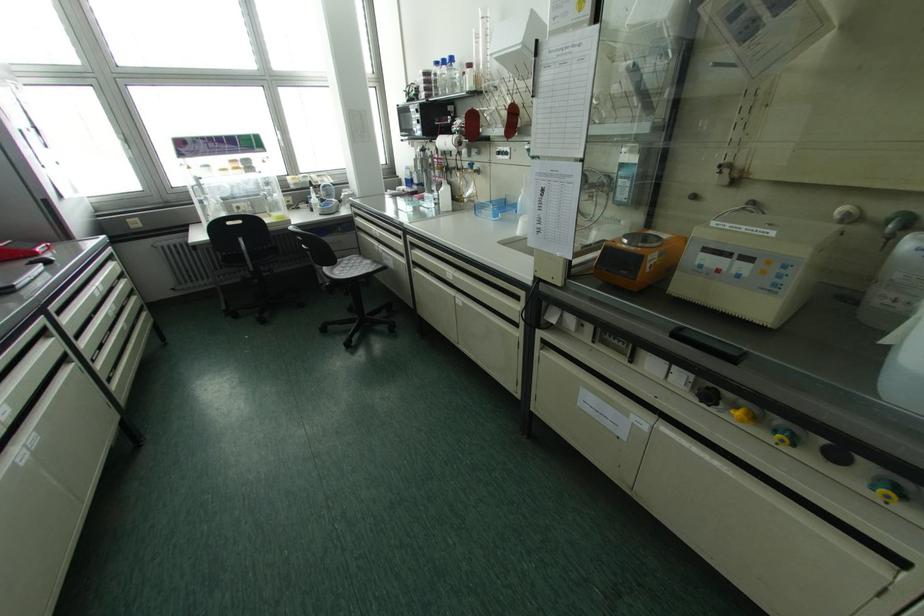
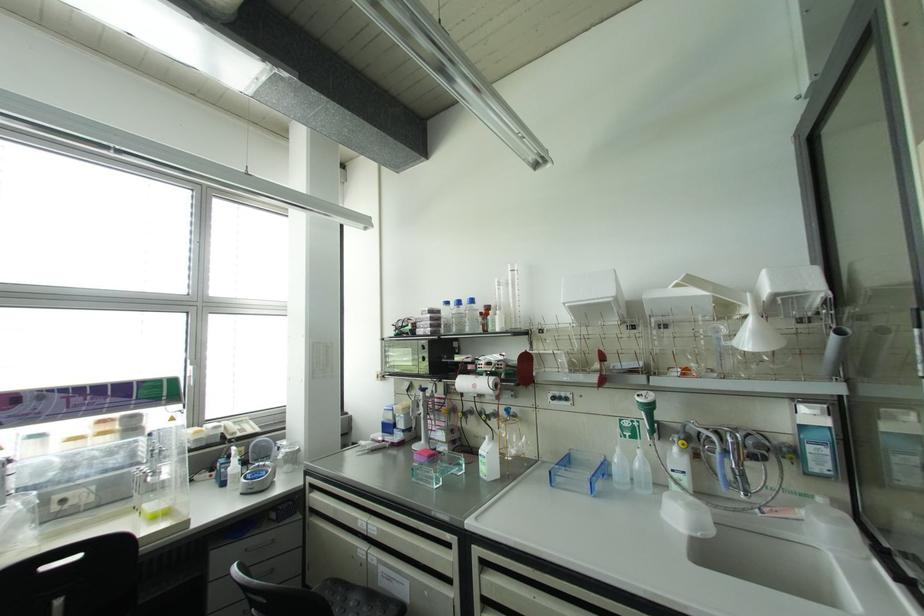
The point at [381,246] is marked in the first image. Where is the corresponding point in the second image?

(373, 554)